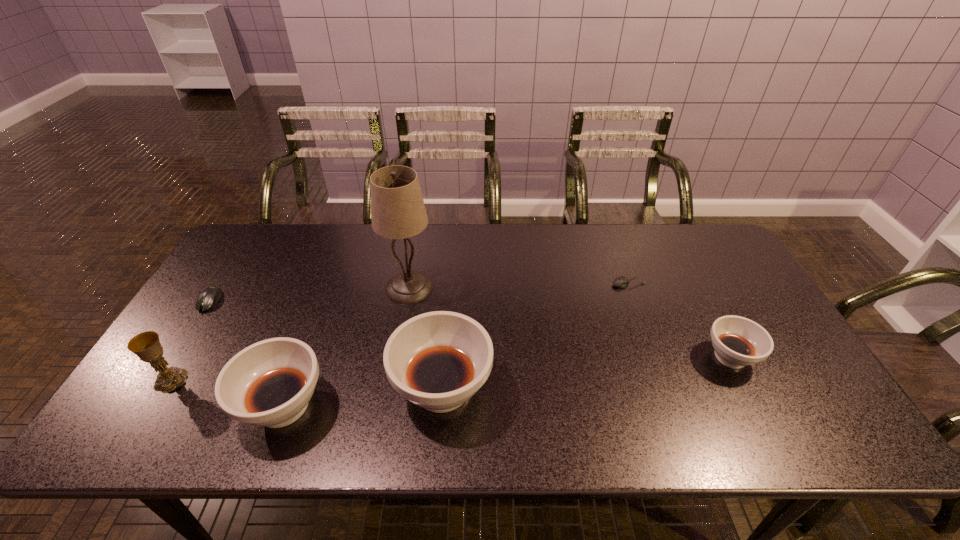
Select which soup bowl is the closest to the sixth tallest object. Please provide its 2D coordinates. Your answer should be formatted as a tuple, i.e. [(x, y)], where the tuple contains the x and y coordinates of a point satisfying the conditions above.

[(269, 383)]

Choose which soup bowl is the second nearest neighbor to the left mouse. Please provide its 2D coordinates. Your answer should be formatted as a tuple, i.e. [(x, y)], where the tuple contains the x and y coordinates of a point satisfying the conditions above.

[(438, 360)]

Find the location of `vacant position in the image that satisfies the following two spatial constraints: 1. on the front-facing side of the lampshade; 2. on the right side of the shortest soup bowl`. vacant position in the image that satisfies the following two spatial constraints: 1. on the front-facing side of the lampshade; 2. on the right side of the shortest soup bowl is located at coordinates (397, 357).

The width and height of the screenshot is (960, 540). I want to click on blank space that satisfies the following two spatial constraints: 1. on the wheel side of the third object from left to right; 2. on the right side of the left mouse, so click(x=142, y=406).

This screenshot has height=540, width=960. What are the coordinates of `vacant point that satisfies the following two spatial constraints: 1. on the back side of the second tallest soup bowl; 2. on the right side of the rightmost soup bowl` in the screenshot? It's located at (301, 357).